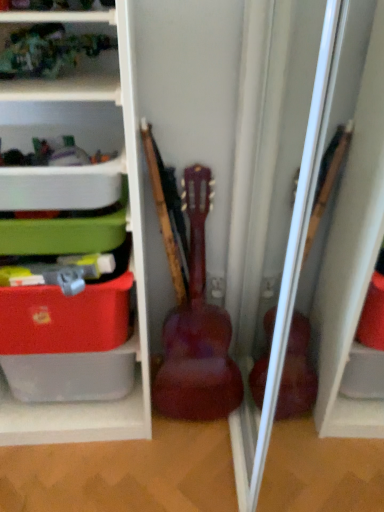
Question: Can you confirm if matte plastic storage box at left is wider than glossy wood guitar at center?

Choices:
 (A) no
 (B) yes

Answer: (A)

Question: Does matte plastic storage box at left appear on the left side of glossy wood guitar at center?

Choices:
 (A) no
 (B) yes

Answer: (B)

Question: Does matte plastic storage box at left appear on the right side of glossy wood guitar at center?

Choices:
 (A) yes
 (B) no

Answer: (B)

Question: Is matte plastic storage box at left positioned far away from glossy wood guitar at center?

Choices:
 (A) yes
 (B) no

Answer: (B)

Question: Is matte plastic storage box at left thinner than glossy wood guitar at center?

Choices:
 (A) yes
 (B) no

Answer: (A)

Question: In the image, is matte plastic storage at left, marked as the 2th shelf in a top-to-bottom arrangement, positioned in front of or behind glossy wood guitar at center?

Choices:
 (A) behind
 (B) front

Answer: (B)

Question: Considering the positions of matte plastic storage at left, the 1th shelf positioned from the bottom, and glossy wood guitar at center in the image, is matte plastic storage at left, the 1th shelf positioned from the bottom, bigger or smaller than glossy wood guitar at center?

Choices:
 (A) small
 (B) big

Answer: (B)

Question: Looking at their shapes, would you say matte plastic storage at left, the 1th shelf positioned from the bottom, is wider or thinner than glossy wood guitar at center?

Choices:
 (A) wide
 (B) thin

Answer: (A)

Question: Is matte plastic storage at left, marked as the 2th shelf in a top-to-bottom arrangement, inside or outside of glossy wood guitar at center?

Choices:
 (A) outside
 (B) inside

Answer: (A)

Question: Considering the positions of matte plastic storage box at left and matte plastic storage at left, marked as the 2th shelf in a top-to-bottom arrangement, in the image, is matte plastic storage box at left taller or shorter than matte plastic storage at left, marked as the 2th shelf in a top-to-bottom arrangement,?

Choices:
 (A) tall
 (B) short

Answer: (B)

Question: From the image's perspective, is matte plastic storage box at left located above or below matte plastic storage at left, marked as the 2th shelf in a top-to-bottom arrangement?

Choices:
 (A) above
 (B) below

Answer: (B)

Question: Looking at their shapes, would you say matte plastic storage box at left is wider or thinner than matte plastic storage at left, marked as the 2th shelf in a top-to-bottom arrangement?

Choices:
 (A) wide
 (B) thin

Answer: (B)

Question: Considering the relative positions of matte plastic storage box at left and matte plastic storage at left, the 1th shelf positioned from the bottom, in the image provided, is matte plastic storage box at left to the left or to the right of matte plastic storage at left, the 1th shelf positioned from the bottom,?

Choices:
 (A) right
 (B) left

Answer: (A)

Question: Is white plastic container at upper left, the 2th shelf ordered from the bottom, spatially inside glossy wood guitar at center, or outside of it?

Choices:
 (A) outside
 (B) inside

Answer: (A)

Question: From the image's perspective, is white plastic container at upper left, the first shelf from the top, located above or below glossy wood guitar at center?

Choices:
 (A) above
 (B) below

Answer: (A)